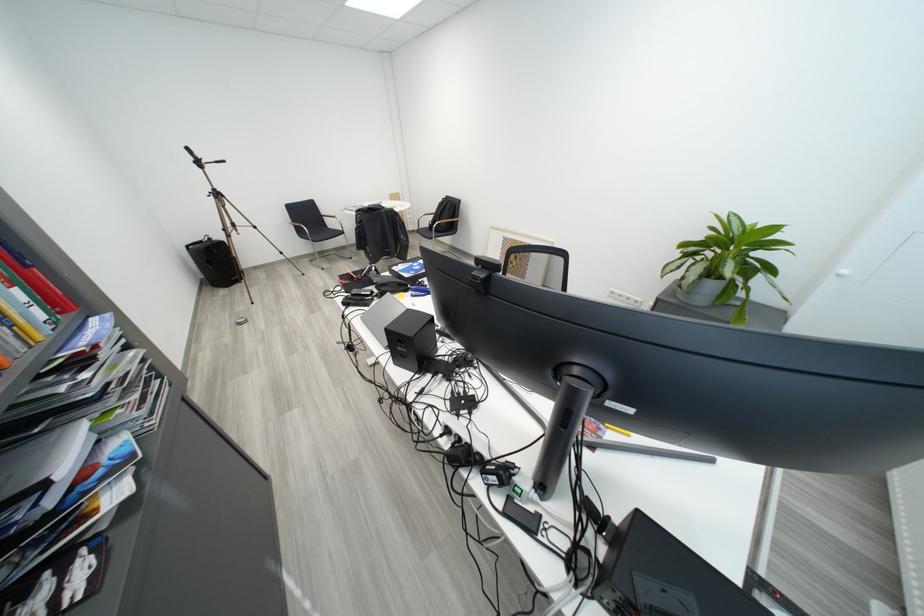
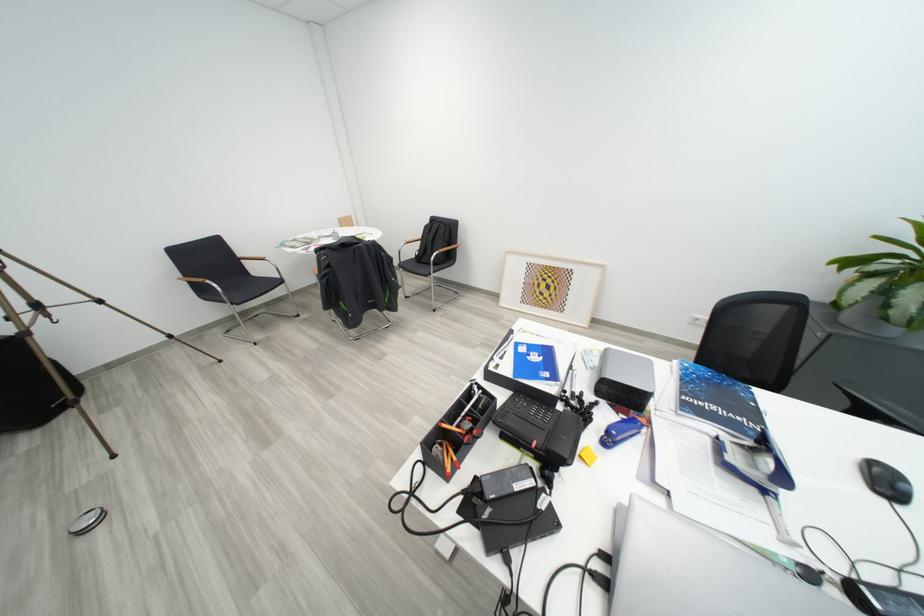
What movement of the cameraman would produce the second image?

The cameraman moved toward left, forward.